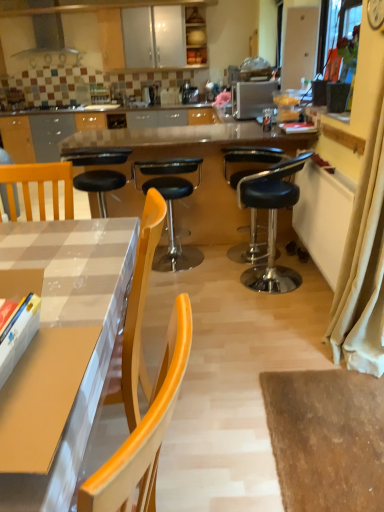
Question: Does beige fabric curtain at right have a greater height compared to black leather stool at center, which is counted as the second chair, starting from the right?

Choices:
 (A) yes
 (B) no

Answer: (A)

Question: From the image's perspective, is beige fabric curtain at right over black leather stool at center, arranged as the second chair when viewed from the left?

Choices:
 (A) yes
 (B) no

Answer: (B)

Question: Is beige fabric curtain at right oriented towards black leather stool at center, arranged as the second chair when viewed from the left?

Choices:
 (A) no
 (B) yes

Answer: (A)

Question: Is beige fabric curtain at right positioned with its back to black leather stool at center, which is counted as the second chair, starting from the right?

Choices:
 (A) yes
 (B) no

Answer: (B)

Question: Is beige fabric curtain at right further to the viewer compared to black leather stool at center, arranged as the second chair when viewed from the left?

Choices:
 (A) yes
 (B) no

Answer: (B)

Question: Would you say black leather stool at center, arranged as the second chair when viewed from the left, is part of beige fabric curtain at right's contents?

Choices:
 (A) yes
 (B) no

Answer: (B)

Question: Can you confirm if black leather stool at center, arranged as the second chair when viewed from the left, is thinner than white paper at center?

Choices:
 (A) yes
 (B) no

Answer: (B)

Question: Is black leather stool at center, which is counted as the second chair, starting from the right, smaller than white paper at center?

Choices:
 (A) yes
 (B) no

Answer: (B)

Question: Is black leather stool at center, arranged as the second chair when viewed from the left, to the right of white paper at center from the viewer's perspective?

Choices:
 (A) no
 (B) yes

Answer: (A)

Question: Is black leather stool at center, which is counted as the second chair, starting from the right, oriented towards white paper at center?

Choices:
 (A) yes
 (B) no

Answer: (B)

Question: Can you confirm if black leather stool at center, arranged as the second chair when viewed from the left, is positioned to the left of white paper at center?

Choices:
 (A) no
 (B) yes

Answer: (B)

Question: Is there a large distance between black leather stool at center, which is counted as the second chair, starting from the right, and white paper at center?

Choices:
 (A) no
 (B) yes

Answer: (A)

Question: Is wooden chair at left taller than metallic silver toaster at upper center?

Choices:
 (A) yes
 (B) no

Answer: (A)